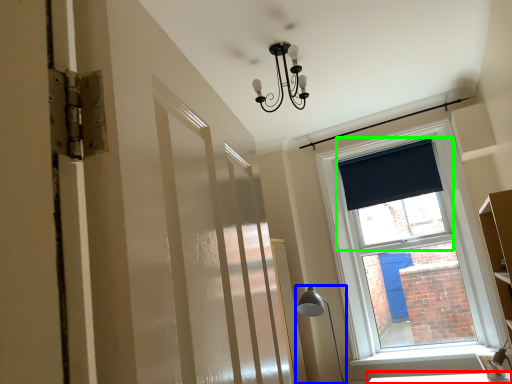
Question: Estimate the real-world distances between objects in this image. Which object is closer to table (highlighted by a red box), table lamp (highlighted by a blue box) or window screen (highlighted by a green box)?

Choices:
 (A) table lamp
 (B) window screen

Answer: (A)